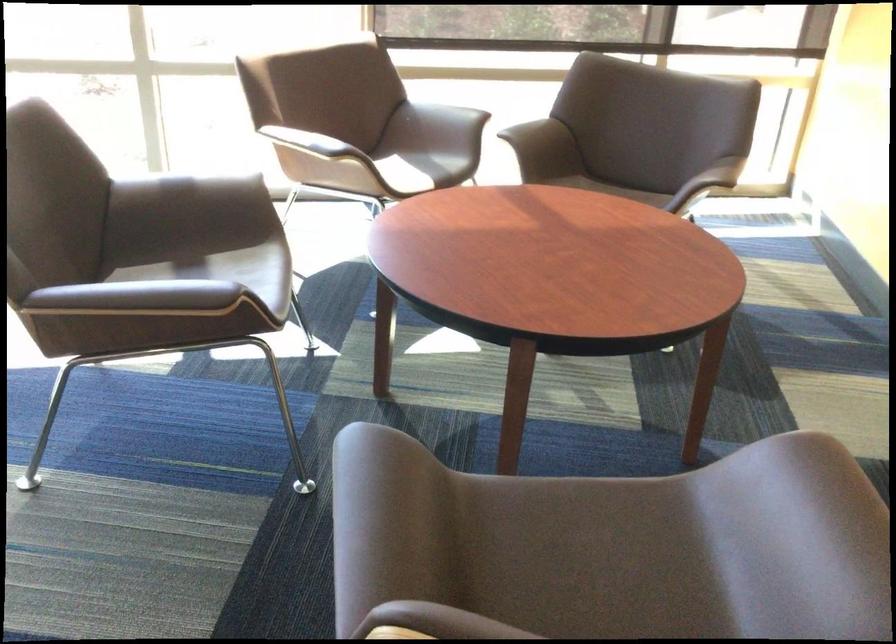
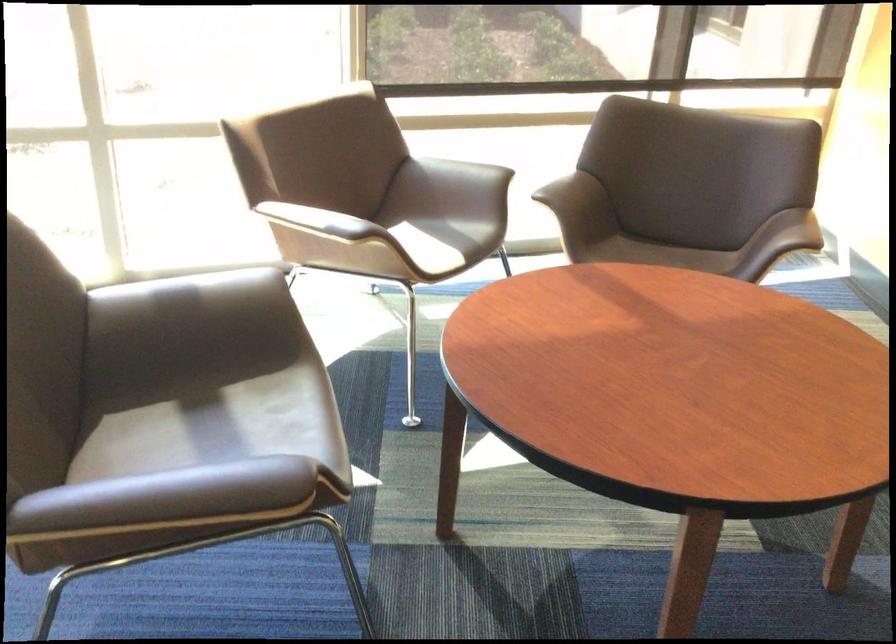
The point at (536, 137) is marked in the first image. Where is the corresponding point in the second image?

(574, 196)